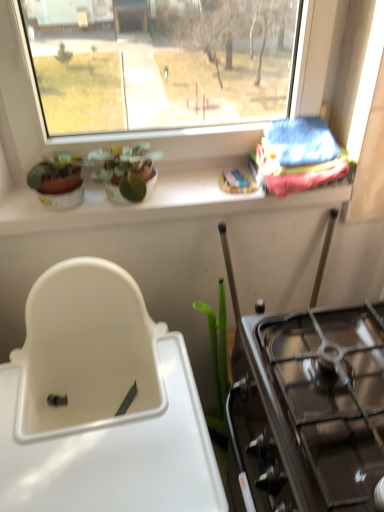
Locate an element on the screen. blank space situated above white ceramic window sill at upper center (from a real-world perspective) is located at coordinates (175, 181).